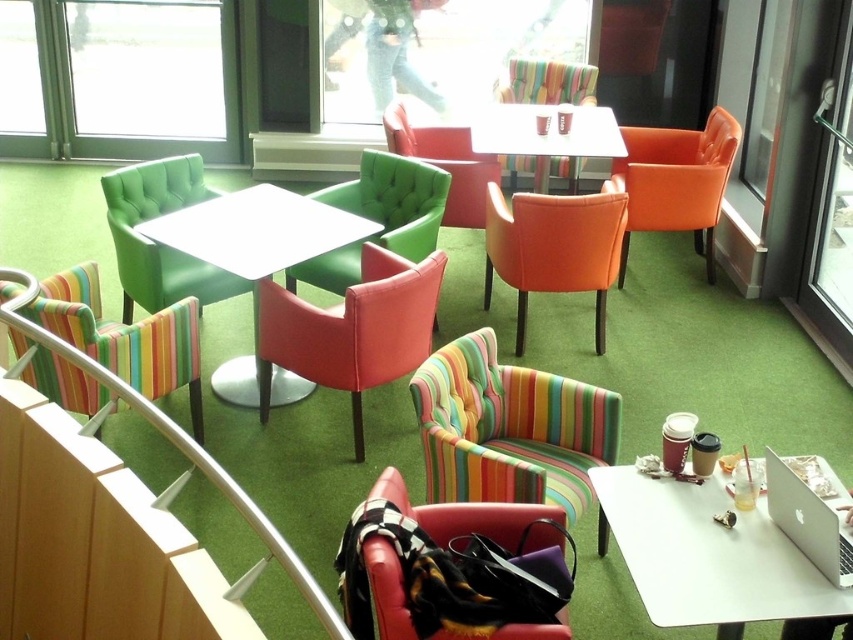
Is matte white table at center smaller than matte black armchair at lower center?

No.

Which is behind, point (329, 205) or point (561, 628)?

The point (329, 205) is behind.

Who is more distant from viewer, (x=221, y=256) or (x=492, y=531)?

Positioned behind is point (x=221, y=256).

This screenshot has width=853, height=640. What are the coordinates of `matte white table at center` in the screenshot? It's located at (257, 230).

Is multicolored striped armchair at lower left smaller than matte orange chair at center?

Correct, multicolored striped armchair at lower left occupies less space than matte orange chair at center.

Does point (74, 342) come behind point (556, 291)?

No, it is not.

Locate an element on the screen. The width and height of the screenshot is (853, 640). multicolored striped armchair at lower left is located at coordinates (125, 337).

Between matte orange chair at center and matte black armchair at lower center, which one appears on the right side from the viewer's perspective?

From the viewer's perspective, matte orange chair at center appears more on the right side.

Is matte orange chair at center positioned at the back of matte black armchair at lower center?

That is True.

Which is behind, point (610, 180) or point (399, 602)?

Point (610, 180)

The height and width of the screenshot is (640, 853). Find the location of `matte orange chair at center`. matte orange chair at center is located at coordinates (554, 248).